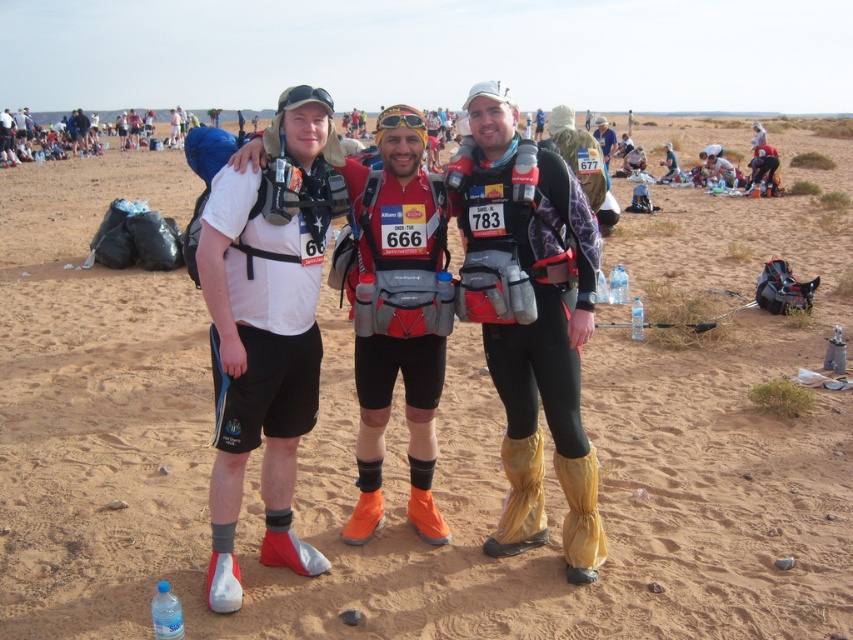
Consider the image. You are a photographer positioned at the back of the group. You want to take a photo that includes both the white matte shorts at center and the shiny gold sunglasses at center. Which object should you focus on first if you want to ensure both are in the frame?

The white matte shorts at center has a lesser height compared to shiny gold sunglasses at center, so you should focus on the shiny gold sunglasses at center first to ensure both are in the frame.

Looking at this image, you are a photographer positioned at the origin point of the coordinate system. You want to capture a photo of the white matte shorts at center. What are the exact coordinates where you should aim your camera?

The white matte shorts at center is located at coordinates point (265,333), so you should aim your camera at those coordinates to capture it.

You are a photographer trying to capture a photo of the matte black pants at center and the white matte shorts at center. From the perspective of someone facing the scene, which object is located to the left of the other?

The white matte shorts at center is located to the left of the matte black pants at center because the matte black pants at center is positioned on the right side of white matte shorts at center.